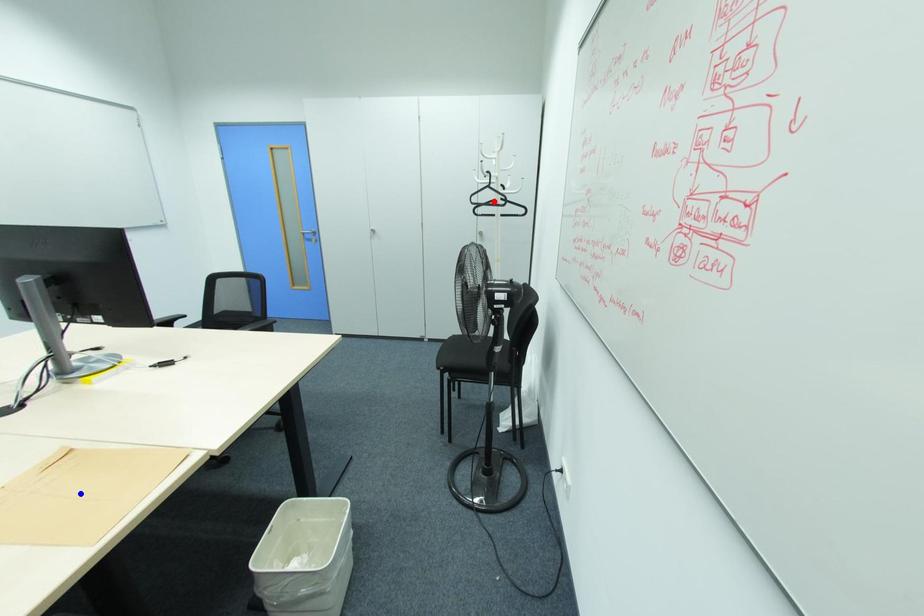
Question: Which of the two points in the image is closer to the camera?

Choices:
 (A) Blue point is closer.
 (B) Red point is closer.

Answer: (A)